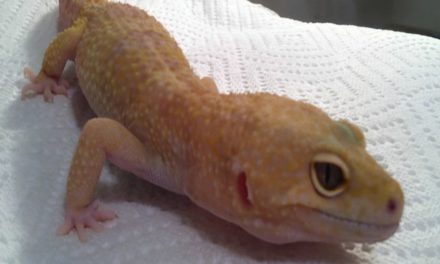
Image resolution: width=440 pixels, height=264 pixels. I want to click on white textured paper towel sheet, so click(x=274, y=57), click(x=128, y=247).